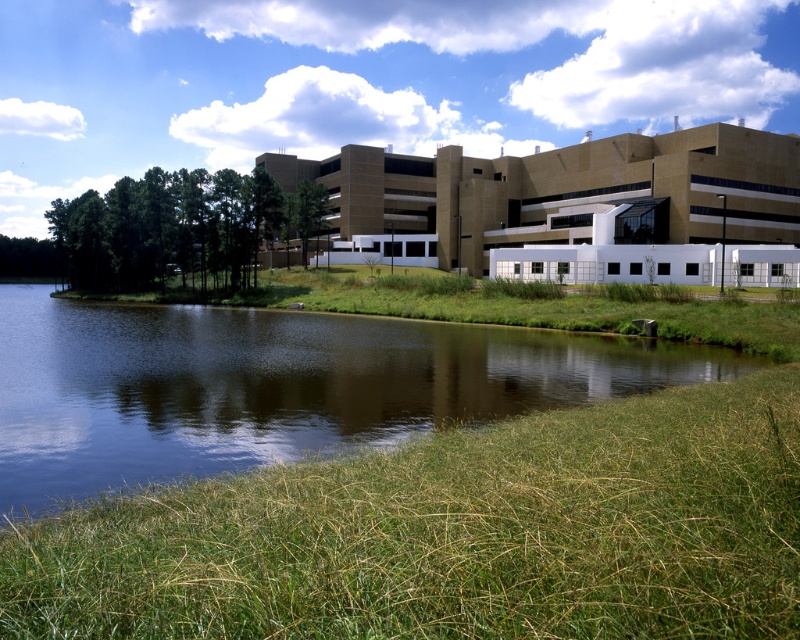
Who is lower down, green grass at lower center or green grassy river at lower left?

green grass at lower center is lower down.

Is point (464, 516) positioned before point (29, 308)?

Yes, it is in front of point (29, 308).

Locate an element on the screen. The height and width of the screenshot is (640, 800). green grass at lower center is located at coordinates (454, 534).